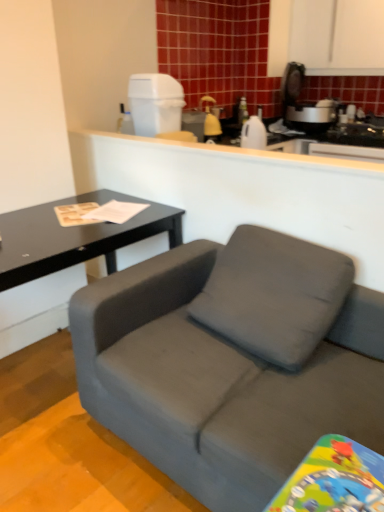
Question: From a real-world perspective, is white matte counter at upper center above or below black matte table at left?

Choices:
 (A) below
 (B) above

Answer: (B)

Question: In terms of width, does white matte counter at upper center look wider or thinner when compared to black matte table at left?

Choices:
 (A) thin
 (B) wide

Answer: (A)

Question: Estimate the real-world distances between objects in this image. Which object is closer to the black matte table at left?

Choices:
 (A) matte gray couch at center
 (B) white matte counter at upper center
 (C) white plastic trash can at upper center, which is counted as the 1th appliance, starting from the front
 (D) matte yellow spray bottle at upper center, the first appliance from the right

Answer: (B)

Question: Based on their relative distances, which object is nearer to the matte yellow spray bottle at upper center, acting as the 1th appliance starting from the back?

Choices:
 (A) black matte table at left
 (B) white matte counter at upper center
 (C) matte gray couch at center
 (D) white plastic trash can at upper center, which is counted as the 1th appliance, starting from the front

Answer: (D)